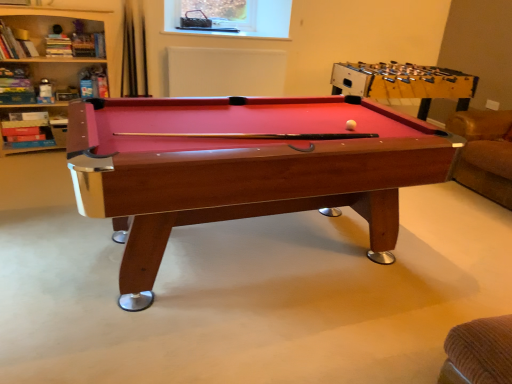
What are the coordinates of `rubberized red pool table at upper right` in the screenshot? It's located at (404, 83).

Measure the distance between wooden bookshelf at upper left and camera.

The depth of wooden bookshelf at upper left is 10.47 feet.

Describe the element at coordinates (87, 19) in the screenshot. I see `wooden bookshelf at upper left` at that location.

You are a GUI agent. You are given a task and a screenshot of the screen. Output one action in this format:
    pyautogui.click(x=<x>, y=<y>)
    Task: Click on the rubberized red pool table at upper right
    The image size is (512, 384).
    Given the screenshot: What is the action you would take?
    pyautogui.click(x=404, y=83)

Is yellow matte ball at center situated inside rubberized red pool table at upper right or outside?

yellow matte ball at center is not inside rubberized red pool table at upper right, it's outside.

From the image's perspective, relative to rubberized red pool table at upper right, is yellow matte ball at center above or below?

From the image's perspective, yellow matte ball at center appears below rubberized red pool table at upper right.

Looking at this image, is yellow matte ball at center facing away from rubberized red pool table at upper right?

No, rubberized red pool table at upper right is not at the back of yellow matte ball at center.

Considering the relative sizes of yellow matte ball at center and rubberized red pool table at upper right in the image provided, is yellow matte ball at center shorter than rubberized red pool table at upper right?

Yes, yellow matte ball at center is shorter than rubberized red pool table at upper right.

Does wooden billiard table at center come behind wooden bookshelf at upper left?

No, the depth of wooden billiard table at center is less than that of wooden bookshelf at upper left.

Would you say wooden billiard table at center is a long distance from wooden bookshelf at upper left?

wooden billiard table at center is positioned a significant distance from wooden bookshelf at upper left.

Is wooden billiard table at center wider or thinner than wooden bookshelf at upper left?

In the image, wooden billiard table at center appears to be wider than wooden bookshelf at upper left.

Find the location of a particular element. This screenshot has height=384, width=512. billiard table below the wooden bookshelf at upper left (from the image's perspective) is located at coordinates (242, 168).

From the image's perspective, between yellow matte ball at center and wooden bookshelf at upper left, which one is located above?

wooden bookshelf at upper left.

Is yellow matte ball at center at the right side of wooden bookshelf at upper left?

Yes.

From a real-world perspective, is yellow matte ball at center above or below wooden bookshelf at upper left?

Clearly, from a real-world perspective, yellow matte ball at center is above wooden bookshelf at upper left.

Are yellow matte ball at center and wooden bookshelf at upper left far apart?

Yes.

Which of these two, wooden billiard table at center or rubberized red pool table at upper right, stands taller?

wooden billiard table at center.

Is wooden billiard table at center located outside rubberized red pool table at upper right?

That's correct, wooden billiard table at center is outside of rubberized red pool table at upper right.

In the scene shown: Is wooden billiard table at center at the left side of rubberized red pool table at upper right?

Yes.

Is wooden billiard table at center positioned far away from rubberized red pool table at upper right?

wooden billiard table at center is positioned a significant distance from rubberized red pool table at upper right.

Considering the sizes of objects rubberized red pool table at upper right and yellow matte ball at center in the image provided, who is bigger, rubberized red pool table at upper right or yellow matte ball at center?

rubberized red pool table at upper right is bigger.

Is rubberized red pool table at upper right with yellow matte ball at center?

They are not placed beside each other.

Image resolution: width=512 pixels, height=384 pixels. Find the location of `ball that appears below the rubberized red pool table at upper right (from the image's perspective)`. ball that appears below the rubberized red pool table at upper right (from the image's perspective) is located at coordinates (351, 125).

Based on the photo, from a real-world perspective, which is physically below, rubberized red pool table at upper right or yellow matte ball at center?

rubberized red pool table at upper right.

Considering the positions of objects wooden bookshelf at upper left and rubberized red pool table at upper right in the image provided, who is more to the right, wooden bookshelf at upper left or rubberized red pool table at upper right?

rubberized red pool table at upper right is more to the right.

From the image's perspective, which one is positioned lower, wooden bookshelf at upper left or rubberized red pool table at upper right?

wooden bookshelf at upper left.

Looking at their sizes, would you say wooden bookshelf at upper left is wider or thinner than rubberized red pool table at upper right?

Considering their sizes, wooden bookshelf at upper left looks slimmer than rubberized red pool table at upper right.

Considering the sizes of objects wooden bookshelf at upper left and yellow matte ball at center in the image provided, who is shorter, wooden bookshelf at upper left or yellow matte ball at center?

yellow matte ball at center is shorter.

From a real-world perspective, between wooden bookshelf at upper left and yellow matte ball at center, who is vertically lower?

From a 3D spatial view, wooden bookshelf at upper left is below.

In the image, is wooden bookshelf at upper left on the left side or the right side of yellow matte ball at center?

Clearly, wooden bookshelf at upper left is on the left of yellow matte ball at center in the image.

In order to click on ball that appears below the wooden bookshelf at upper left (from the image's perspective) in this screenshot , I will do `click(351, 125)`.

The width and height of the screenshot is (512, 384). In order to click on ball below the rubberized red pool table at upper right (from the image's perspective) in this screenshot , I will do `click(351, 125)`.

Identify the location of bookshelf on the left of wooden billiard table at center. (87, 19).

Based on their spatial positions, is rubberized red pool table at upper right or wooden bookshelf at upper left further from wooden billiard table at center?

wooden bookshelf at upper left.

Which object lies nearer to the anchor point wooden billiard table at center, rubberized red pool table at upper right or yellow matte ball at center?

yellow matte ball at center lies closer to wooden billiard table at center than the other object.

From the image, which object appears to be nearer to wooden bookshelf at upper left, yellow matte ball at center or wooden billiard table at center?

Based on the image, wooden billiard table at center appears to be nearer to wooden bookshelf at upper left.

When comparing their distances from yellow matte ball at center, does wooden bookshelf at upper left or wooden billiard table at center seem closer?

The object closer to yellow matte ball at center is wooden billiard table at center.

Which object lies further to the anchor point wooden bookshelf at upper left, yellow matte ball at center or rubberized red pool table at upper right?

Among the two, yellow matte ball at center is located further to wooden bookshelf at upper left.

Estimate the real-world distances between objects in this image. Which object is closer to rubberized red pool table at upper right, yellow matte ball at center or wooden bookshelf at upper left?

yellow matte ball at center is closer to rubberized red pool table at upper right.

Looking at the image, which one is located closer to rubberized red pool table at upper right, wooden bookshelf at upper left or wooden billiard table at center?

wooden billiard table at center is closer to rubberized red pool table at upper right.

From the image, which object appears to be nearer to wooden bookshelf at upper left, rubberized red pool table at upper right or yellow matte ball at center?

Based on the image, rubberized red pool table at upper right appears to be nearer to wooden bookshelf at upper left.

Locate an element on the screen. ball situated between wooden bookshelf at upper left and rubberized red pool table at upper right from left to right is located at coordinates (351, 125).

At what (x,y) coordinates should I click in order to perform the action: click on billiard table between wooden bookshelf at upper left and yellow matte ball at center. Please return your answer as a coordinate pair (x, y). The image size is (512, 384). Looking at the image, I should click on (242, 168).

Where is `ball located between wooden billiard table at center and rubberized red pool table at upper right in the depth direction`? ball located between wooden billiard table at center and rubberized red pool table at upper right in the depth direction is located at coordinates (351, 125).

The height and width of the screenshot is (384, 512). I want to click on billiard table between wooden bookshelf at upper left and rubberized red pool table at upper right from left to right, so click(242, 168).